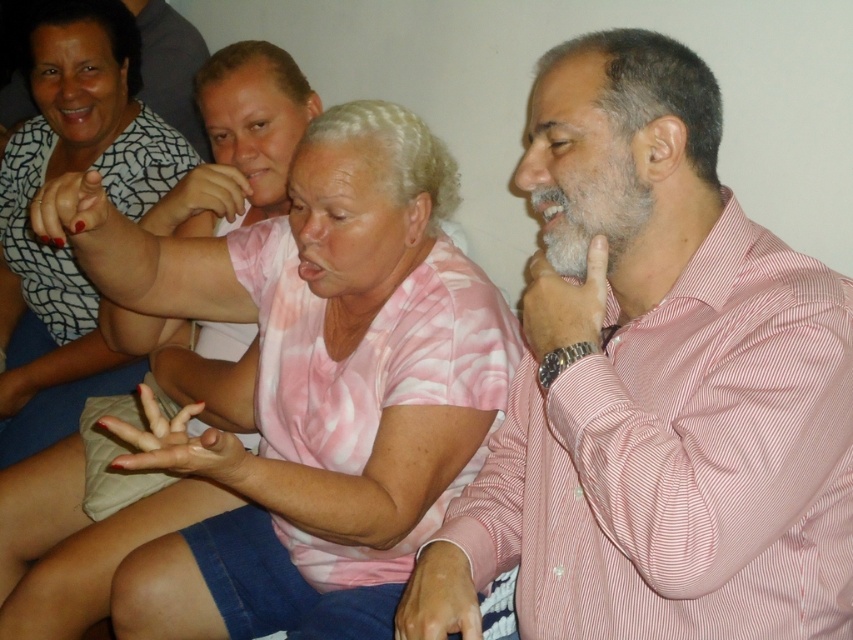
Consider the image. You are a photographer trying to capture a candid shot of the group. You notice the pink striped shirt at right and the matte black shirt at upper left. Which of these two shirts is closer to the camera?

The pink striped shirt at right is positioned under the matte black shirt at upper left, meaning it is closer to the camera since it is below the other shirt in the frame.